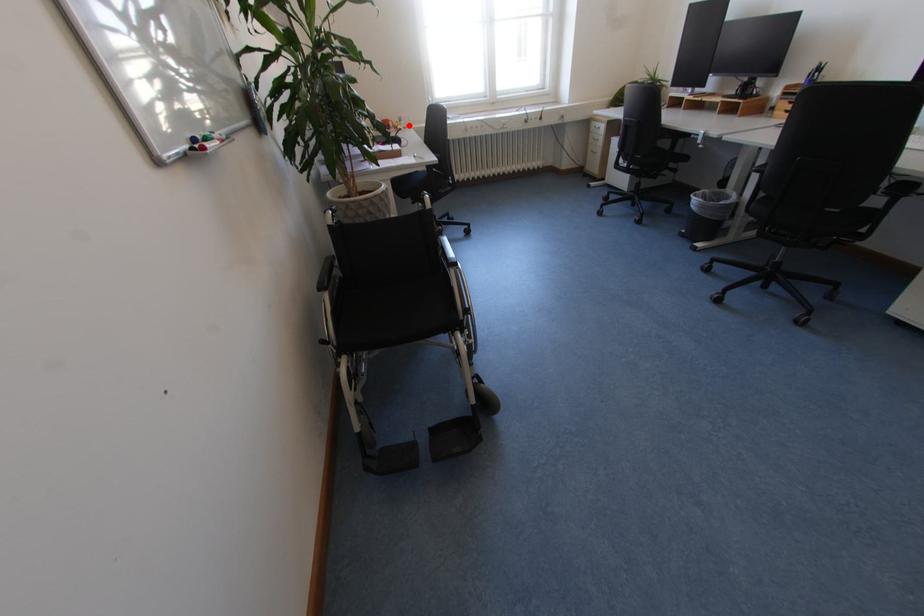
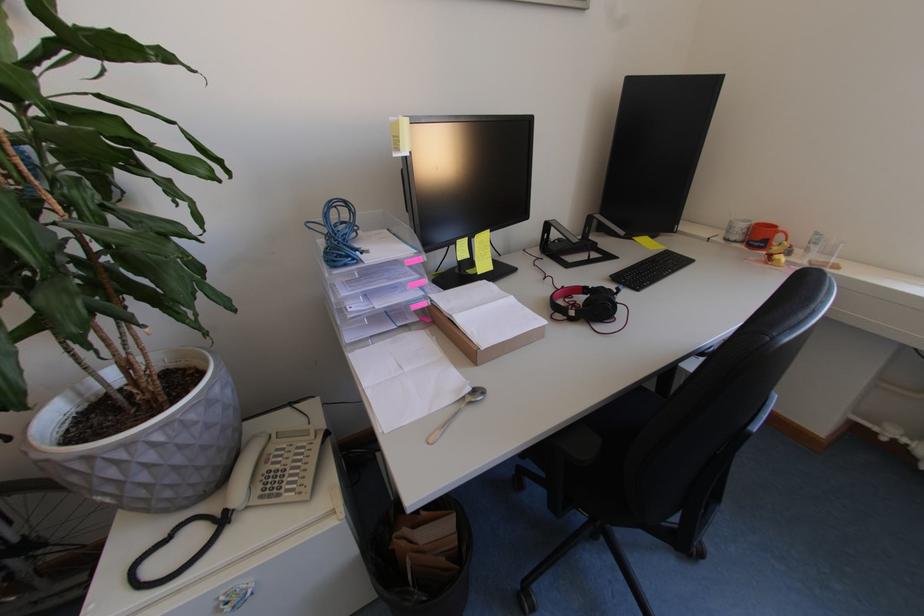
Question: A red point is marked in image1. In image2, is the corresponding 3D point closer to the camera or farther? Reply with the corresponding letter.

Choices:
 (A) The corresponding 3D point is closer.
 (B) The corresponding 3D point is farther.

Answer: (B)